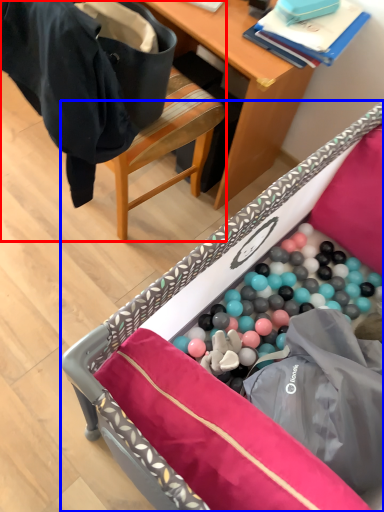
Question: Which of the following is the closest to the observer, chair (highlighted by a red box) or furniture (highlighted by a blue box)?

Choices:
 (A) chair
 (B) furniture

Answer: (B)